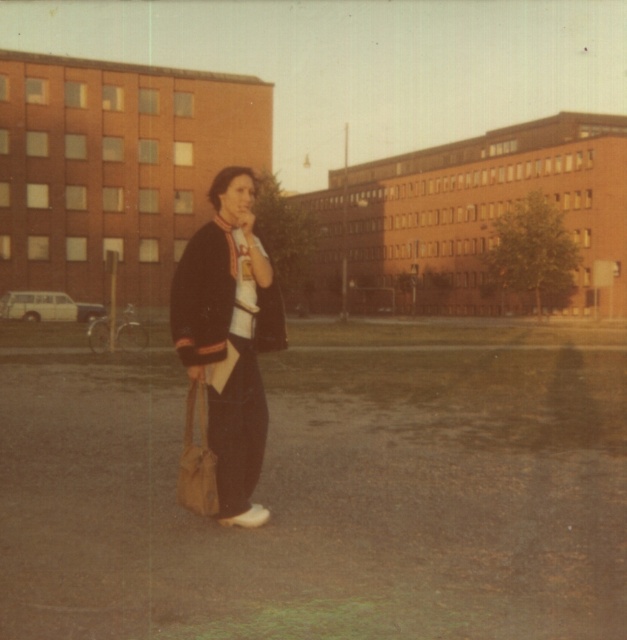
Is matte black jacket at center shorter than leather-like brown bag at center?

No.

Can you confirm if matte black jacket at center is thinner than leather-like brown bag at center?

No, matte black jacket at center is not thinner than leather-like brown bag at center.

Does point (229, 266) lie behind point (203, 454)?

No, (229, 266) is in front of (203, 454).

The image size is (627, 640). I want to click on matte black jacket at center, so click(x=229, y=337).